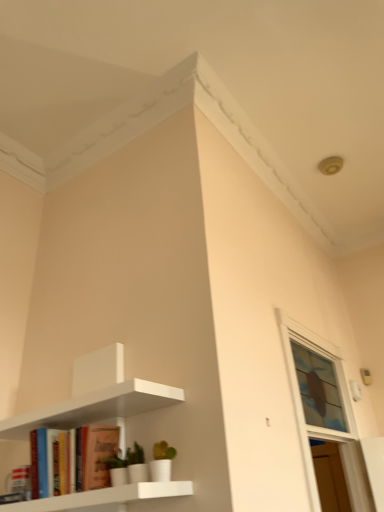
Question: Would you say white matte shelf at upper left is inside or outside matte orange book at lower left?

Choices:
 (A) inside
 (B) outside

Answer: (B)

Question: Considering the relative positions of white matte shelf at upper left and matte orange book at lower left in the image provided, is white matte shelf at upper left to the left or to the right of matte orange book at lower left?

Choices:
 (A) right
 (B) left

Answer: (B)

Question: Considering the real-world distances, which object is closest to the clear glass window at upper right?

Choices:
 (A) matte orange book at lower left
 (B) white matte shelf at upper left

Answer: (B)

Question: Estimate the real-world distances between objects in this image. Which object is closer to the matte orange book at lower left?

Choices:
 (A) white matte shelf at upper left
 (B) clear glass window at upper right

Answer: (A)